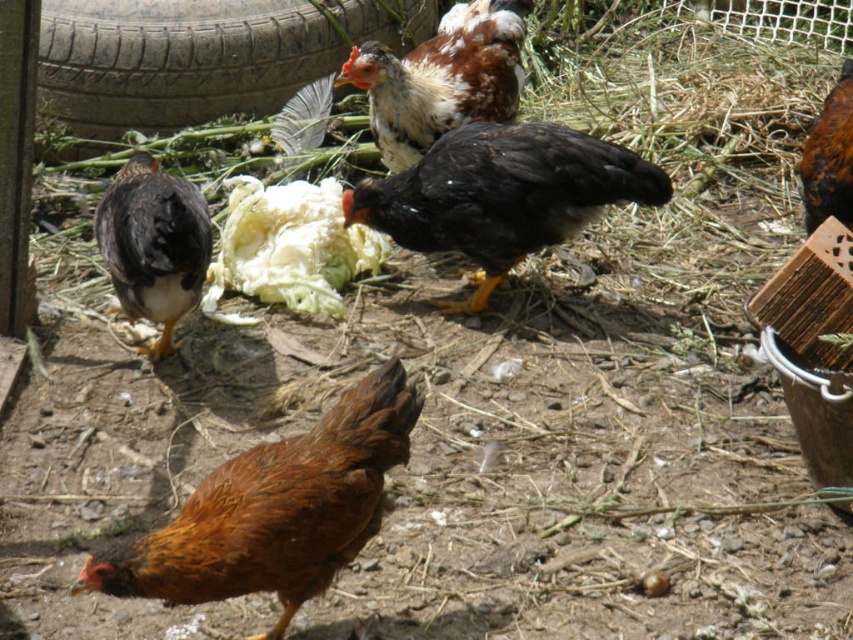
You are a farmer checking the farmyard. You have a white crisp cabbage at center and a matte black chicken at left. Which object is taller?

The matte black chicken at left is taller than the white crisp cabbage at center.

You are a farmer standing in the farmyard and want to place a new fence post between the two points marked as point (x=299, y=289) and point (x=161, y=221). Which point is closer to you so you can start digging the hole first?

Point (x=161, y=221) is closer to you than point (x=299, y=289), so you should start digging the hole there first.

Looking at this image, you are standing in the farmyard and want to pet the brown feathered chicken at lower center. Considering that your outstretched hand can reach up to 1.8 meters, will you be able to reach the chicken without moving closer?

The brown feathered chicken at lower center is 2.05 meters away from the viewer. Since your outstretched hand can only reach up to 1.8 meters, you will not be able to reach the chicken without moving closer.